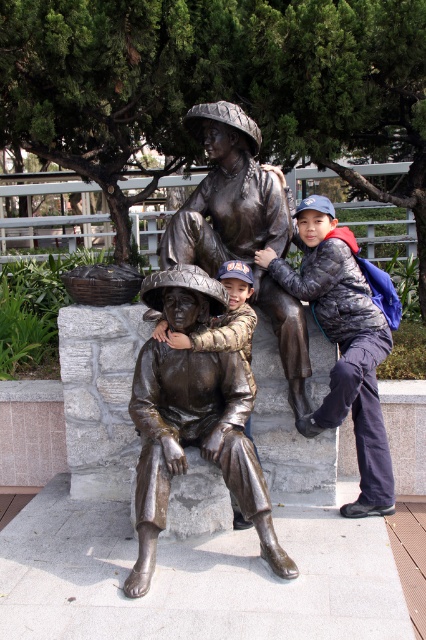
Question: In this image, where is bronze statue of family at center located relative to dark gray quilted jacket at right?

Choices:
 (A) below
 (B) above

Answer: (B)

Question: Considering the relative positions of bronze statue of family at center and bronze statue of child at center in the image provided, where is bronze statue of family at center located with respect to bronze statue of child at center?

Choices:
 (A) below
 (B) above

Answer: (B)

Question: Which object is farther from the camera taking this photo?

Choices:
 (A) bronze statue of family at center
 (B) bronze statue at center
 (C) bronze statue of child at center

Answer: (A)

Question: Which point is closer to the camera?

Choices:
 (A) dark gray quilted jacket at right
 (B) bronze statue at center
 (C) bronze statue of child at center

Answer: (B)

Question: Does bronze statue at center have a greater width compared to dark gray quilted jacket at right?

Choices:
 (A) no
 (B) yes

Answer: (B)

Question: Which object is closer to the camera taking this photo?

Choices:
 (A) bronze statue of child at center
 (B) dark gray quilted jacket at right
 (C) bronze statue of family at center

Answer: (A)